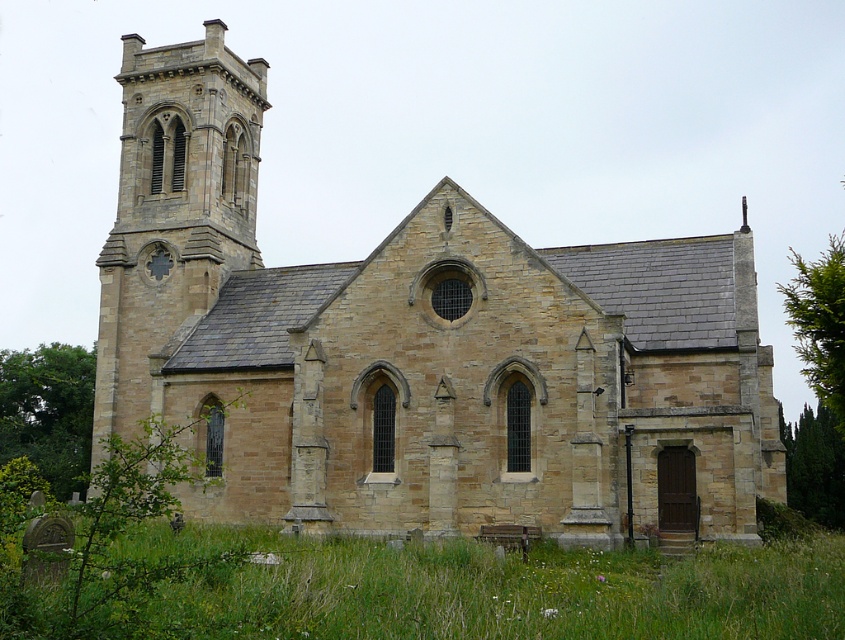
You are standing at the entrance of the beige stone church at center. If you walk straight ahead, will you exit the church grounds through the main gate located at point 0.6, 0.5?

The beige stone church at center is located at point (418, 349). Since the main gate is at (422, 384), walking straight ahead from the entrance would lead you towards the main gate as the coordinates are very close, so yes, you would exit through the main gate.

You are standing in front of the church and notice two points marked on its facade. The first point is at coordinates point (555, 292) and the second at point (521, 593). Which point is closer to you?

Point (555, 292) is closer to you because it is further to the viewer than point (521, 593).

You are standing in front of the beige stone church at center and want to walk to the green grass at lower center. Which direction should you move relative to the church?

The beige stone church at center is to the right of green grass at lower center, so you should move to the left relative to the church to reach the green grass at lower center.